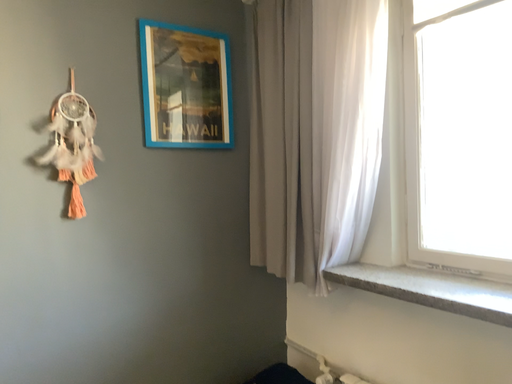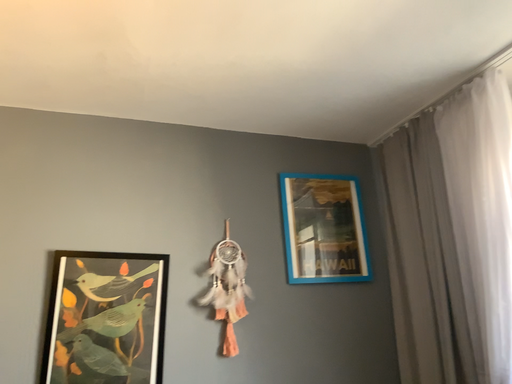
Question: How did the camera likely rotate when shooting the video?

Choices:
 (A) rotated right
 (B) rotated left

Answer: (B)